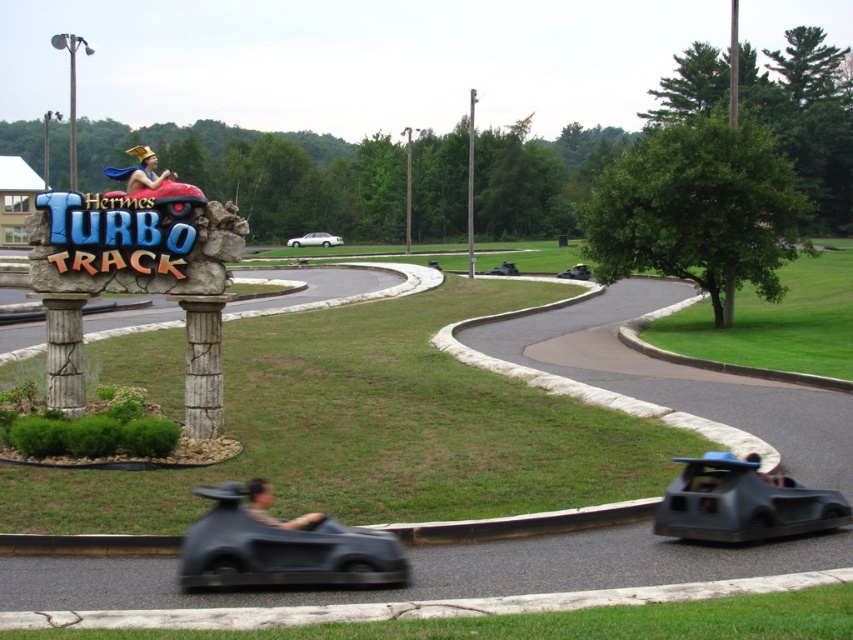
Who is positioned more to the left, matte black go-kart at lower center or white glossy sedan at center?

Positioned to the left is white glossy sedan at center.

Between matte black go-kart at lower center and white glossy sedan at center, which one has more height?

With more height is white glossy sedan at center.

What do you see at coordinates (281, 545) in the screenshot? I see `matte black go-kart at lower center` at bounding box center [281, 545].

Find the location of a particular element. The height and width of the screenshot is (640, 853). matte black go-kart at lower center is located at coordinates (281, 545).

Can you confirm if black plastic go-kart at right is positioned above white glossy sedan at center?

No, black plastic go-kart at right is not above white glossy sedan at center.

Between point (666, 509) and point (317, 241), which one is positioned in front?

Positioned in front is point (666, 509).

You are a GUI agent. You are given a task and a screenshot of the screen. Output one action in this format:
    pyautogui.click(x=<x>, y=<y>)
    Task: Click on the black plastic go-kart at right
    The width and height of the screenshot is (853, 640).
    Given the screenshot: What is the action you would take?
    pyautogui.click(x=741, y=502)

Measure the distance between matte black go-kart at lower center and black plastic go-kart at right.

They are 3.20 meters apart.

Is matte black go-kart at lower center further to the viewer compared to black plastic go-kart at right?

No, it is in front of black plastic go-kart at right.

Who is more forward, [218,554] or [728,477]?

Point [218,554] is more forward.

The height and width of the screenshot is (640, 853). Identify the location of matte black go-kart at lower center. (281, 545).